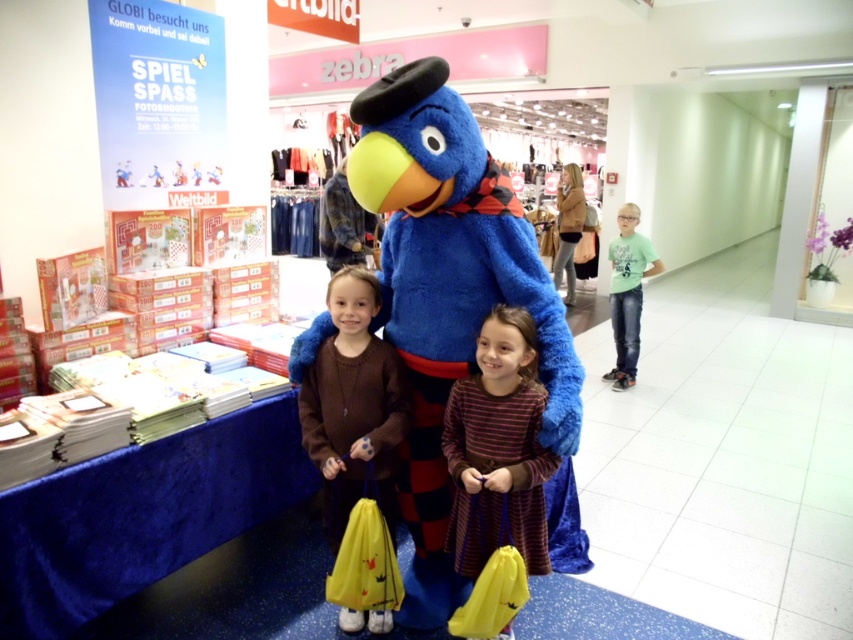
Image resolution: width=853 pixels, height=640 pixels. Describe the element at coordinates (497, 458) in the screenshot. I see `striped cotton dress at center` at that location.

Which is in front, point (467, 563) or point (612, 330)?

Point (467, 563) is in front.

Where is `striped cotton dress at center`? The height and width of the screenshot is (640, 853). striped cotton dress at center is located at coordinates (497, 458).

Does blue plush bird at center appear on the left side of green cotton shirt at right?

Yes, blue plush bird at center is to the left of green cotton shirt at right.

Who is more distant from viewer, [442,76] or [624,276]?

Point [624,276]

At what (x,y) coordinates should I click in order to perform the action: click on blue plush bird at center. Please return your answer as a coordinate pair (x, y). Looking at the image, I should click on (456, 307).

Is blue plush bird at center smaller than striped cotton dress at center?

No, blue plush bird at center is not smaller than striped cotton dress at center.

Measure the distance between blue plush bird at center and camera.

blue plush bird at center is 1.71 meters from camera.

The height and width of the screenshot is (640, 853). What do you see at coordinates (456, 307) in the screenshot?
I see `blue plush bird at center` at bounding box center [456, 307].

Image resolution: width=853 pixels, height=640 pixels. I want to click on blue plush bird at center, so pos(456,307).